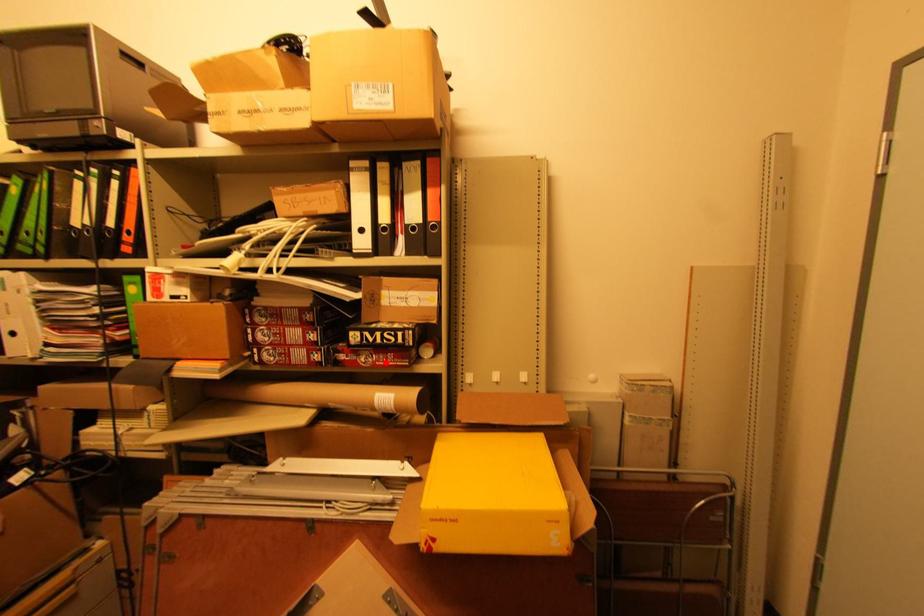
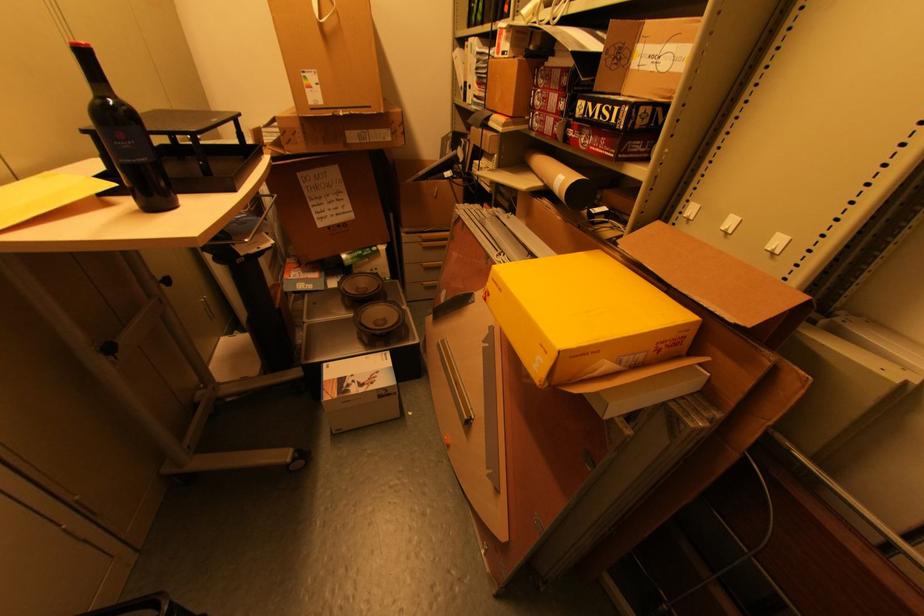
The point at the highlighted location is marked in the first image. Where is the corresponding point in the second image?

(599, 148)